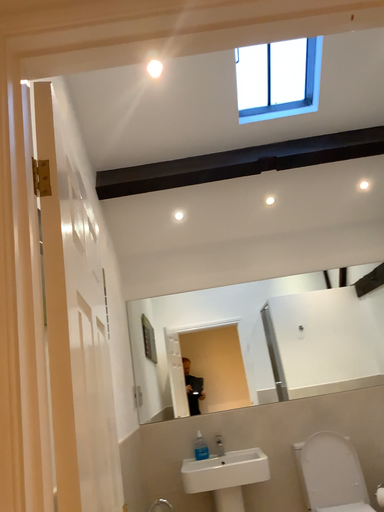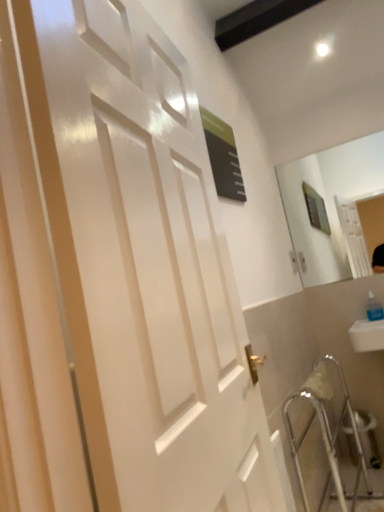
Question: Which way did the camera rotate in the video?

Choices:
 (A) rotated downward
 (B) rotated upward

Answer: (A)